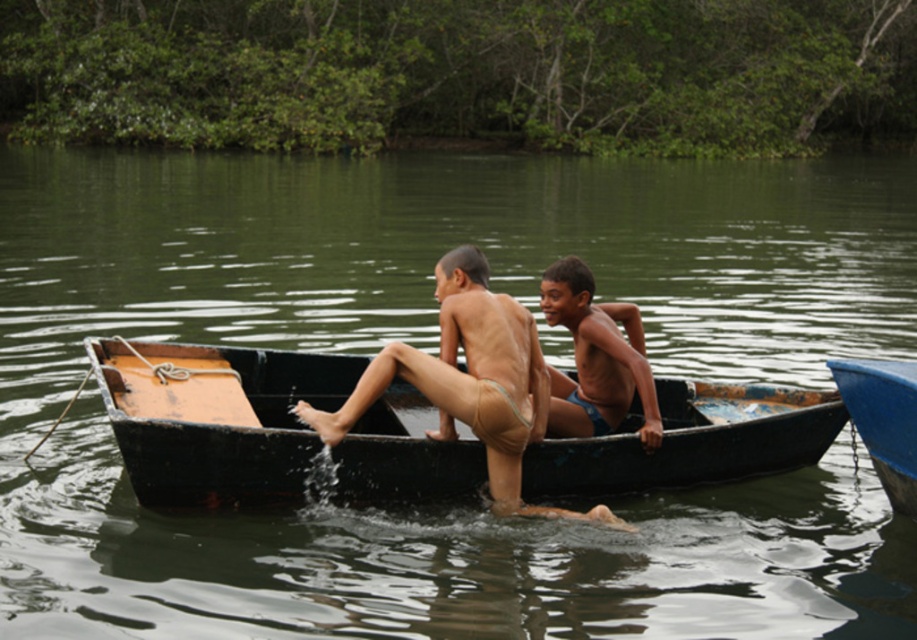
Question: Is blue fabric shorts at center positioned in front of blue glossy canoe at right?

Choices:
 (A) no
 (B) yes

Answer: (A)

Question: Considering the real-world distances, which object is closest to the blue fabric shorts at center?

Choices:
 (A) rusty metal canoe at center
 (B) blue glossy canoe at right

Answer: (B)

Question: Which object is the farthest from the rusty metal canoe at center?

Choices:
 (A) blue glossy canoe at right
 (B) blue fabric shorts at center

Answer: (A)

Question: Is rusty metal canoe at center smaller than blue glossy canoe at right?

Choices:
 (A) yes
 (B) no

Answer: (A)

Question: Is the position of blue fabric shorts at center less distant than that of blue glossy canoe at right?

Choices:
 (A) yes
 (B) no

Answer: (B)

Question: Which point is farther to the camera?

Choices:
 (A) (623, 305)
 (B) (898, 440)

Answer: (A)